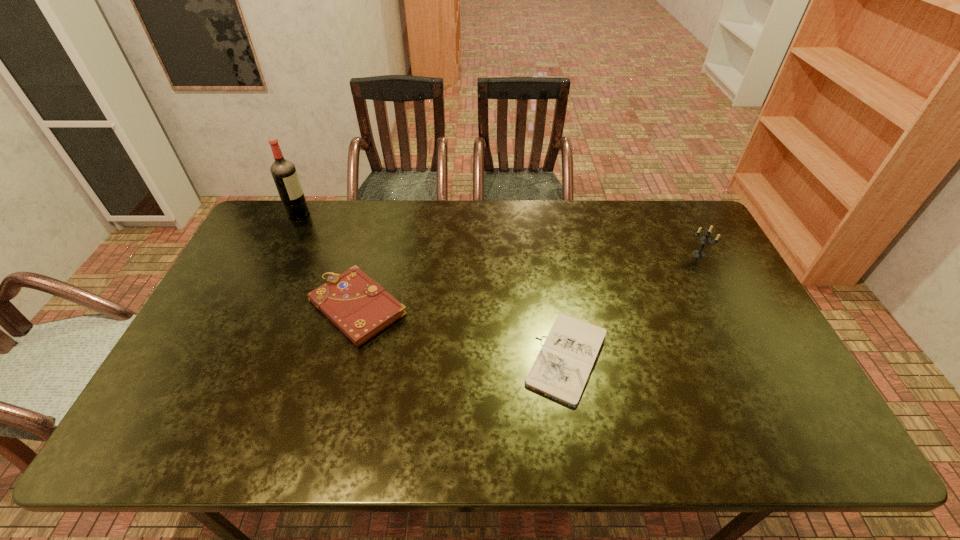
In the image, there is a desktop. At what (x,y) coordinates should I click in order to perform the action: click on vacant space at the near right corner. Please return your answer as a coordinate pair (x, y). The height and width of the screenshot is (540, 960). Looking at the image, I should click on (787, 417).

Where is `free space between the farthest object and the candle holder`? free space between the farthest object and the candle holder is located at coordinates (498, 234).

I want to click on free space between the shortest object and the third shortest object, so click(x=634, y=307).

The image size is (960, 540). I want to click on unoccupied area between the second farthest object and the second shortest object, so click(x=528, y=281).

This screenshot has width=960, height=540. What are the coordinates of `unoccupied area between the taller notebook and the shorter notebook` in the screenshot? It's located at (463, 334).

The height and width of the screenshot is (540, 960). I want to click on unoccupied area between the rightmost object and the farthest object, so click(x=498, y=234).

Image resolution: width=960 pixels, height=540 pixels. What are the coordinates of `unoccupied area between the third shortest object and the tallest object` in the screenshot? It's located at (498, 234).

Locate an element on the screen. The image size is (960, 540). empty location between the left notebook and the second farthest object is located at coordinates (528, 281).

Find the location of `free space between the second shortest object and the shorter notebook`. free space between the second shortest object and the shorter notebook is located at coordinates (463, 334).

Where is `free spot between the third object from right to left and the farthest object`? The height and width of the screenshot is (540, 960). free spot between the third object from right to left and the farthest object is located at coordinates (328, 260).